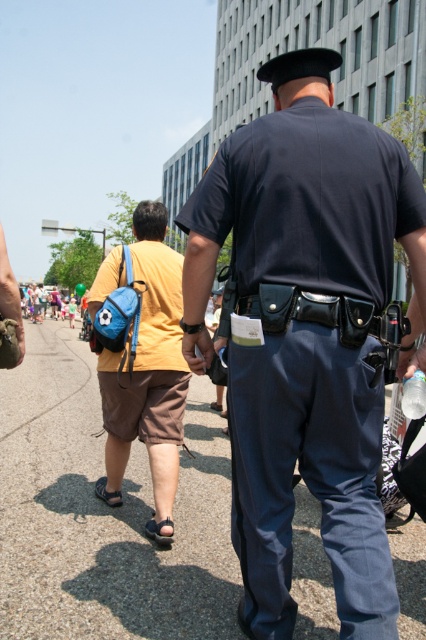
Question: Which of the following is the closest to the observer?

Choices:
 (A) navy blue uniform at center
 (B) matte blue backpack at center
 (C) gray asphalt pavement at center

Answer: (A)

Question: Can you confirm if gray asphalt pavement at center is bigger than matte blue backpack at center?

Choices:
 (A) yes
 (B) no

Answer: (A)

Question: Which point is farther to the camera?

Choices:
 (A) navy blue uniform at center
 (B) matte blue backpack at center
 (C) gray asphalt pavement at center

Answer: (B)

Question: Can you confirm if gray asphalt pavement at center is positioned below matte blue backpack at center?

Choices:
 (A) no
 (B) yes

Answer: (B)

Question: Is navy blue uniform at center positioned before matte blue backpack at center?

Choices:
 (A) no
 (B) yes

Answer: (B)

Question: Which is farther from the matte blue backpack at center?

Choices:
 (A) navy blue uniform at center
 (B) gray asphalt pavement at center

Answer: (B)